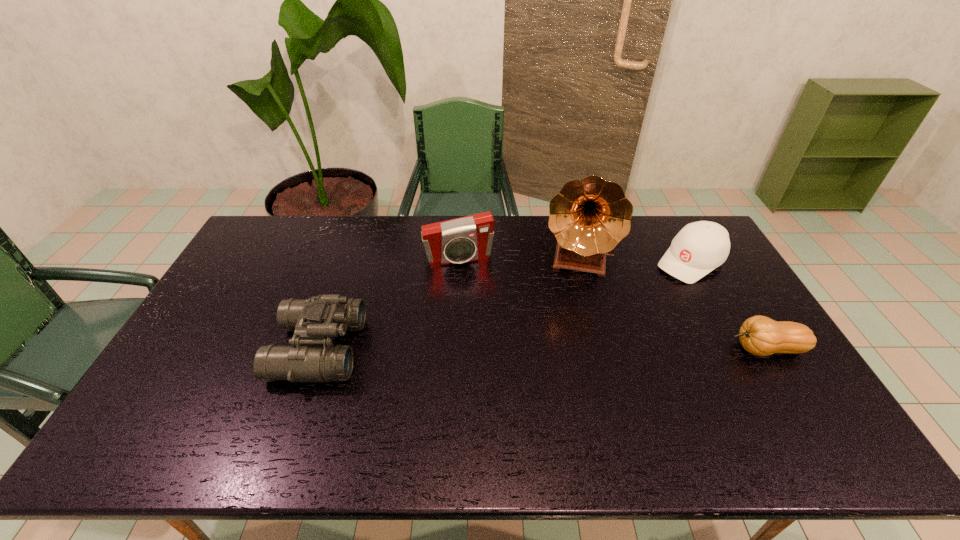
This screenshot has height=540, width=960. Find the location of `free region located 0.100m on the horn of the third object from left to right`. free region located 0.100m on the horn of the third object from left to right is located at coordinates (570, 307).

Locate an element on the screen. This screenshot has width=960, height=540. vacant space located on the horn of the third object from left to right is located at coordinates (569, 321).

Where is `vacant space located on the horn of the third object from left to right`? vacant space located on the horn of the third object from left to right is located at coordinates (569, 321).

Image resolution: width=960 pixels, height=540 pixels. Identify the location of vacant space located on the front-facing side of the fourth tallest object. (621, 311).

This screenshot has height=540, width=960. Find the location of `blank space located 0.160m on the front-facing side of the fourth tallest object`. blank space located 0.160m on the front-facing side of the fourth tallest object is located at coordinates (641, 297).

Where is `free space located on the front-facing side of the fourth tallest object`? This screenshot has width=960, height=540. free space located on the front-facing side of the fourth tallest object is located at coordinates (631, 304).

The image size is (960, 540). In order to click on vacant space situated 0.080m on the front-facing side of the camera in this screenshot , I will do `click(468, 284)`.

Image resolution: width=960 pixels, height=540 pixels. I want to click on vacant space located 0.050m on the front-facing side of the camera, so click(468, 278).

You are a GUI agent. You are given a task and a screenshot of the screen. Output one action in this format:
    pyautogui.click(x=<x>, y=<y>)
    Task: Click on the blank space located on the front-facing side of the camera
    This screenshot has width=960, height=540.
    Given the screenshot: What is the action you would take?
    pyautogui.click(x=475, y=312)

Identify the location of phonograph_record positioned at the far edge. This screenshot has width=960, height=540. (589, 217).